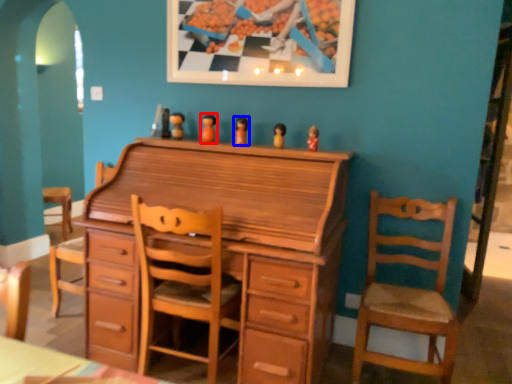
Question: Which of the following is the closest to the observer, toy (highlighted by a red box) or toy (highlighted by a blue box)?

Choices:
 (A) toy
 (B) toy

Answer: (B)